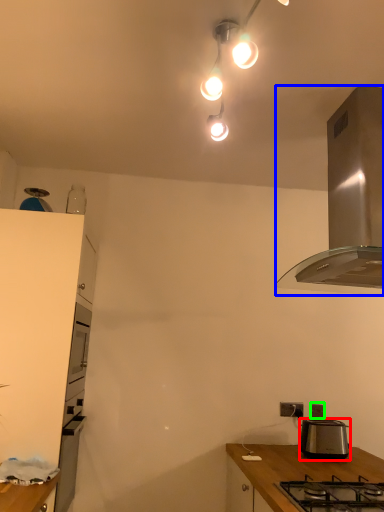
Question: Based on their relative distances, which object is nearer to toaster (highlighted by a red box)? Choose from kitchen appliance (highlighted by a blue box) and power outlet (highlighted by a green box).

Choices:
 (A) kitchen appliance
 (B) power outlet

Answer: (B)